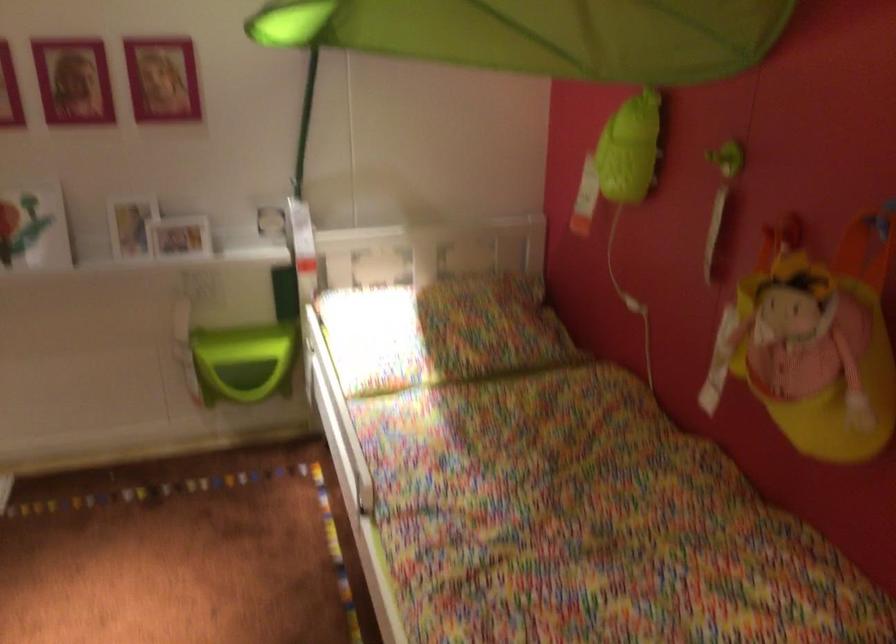
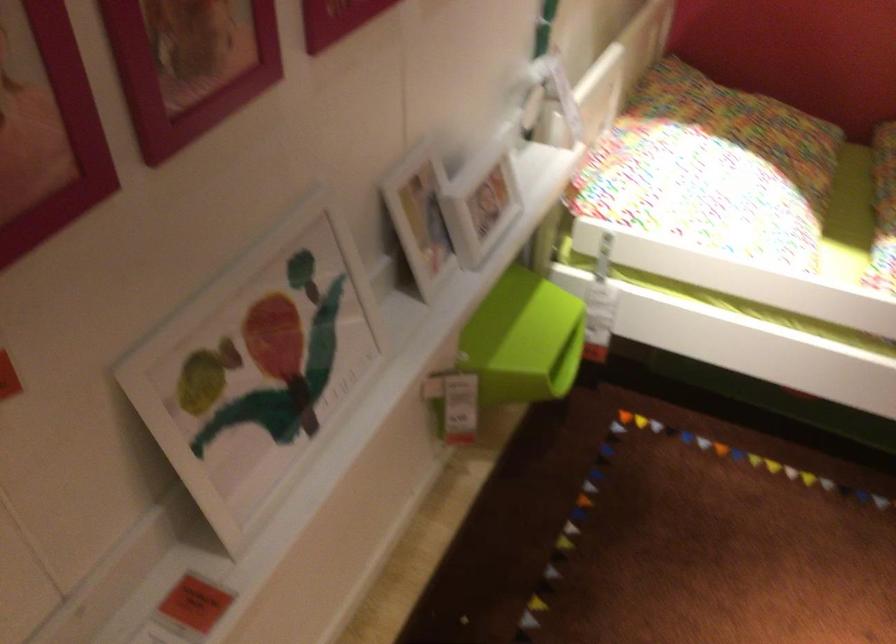
The point at (234, 354) is marked in the first image. Where is the corresponding point in the second image?

(522, 339)